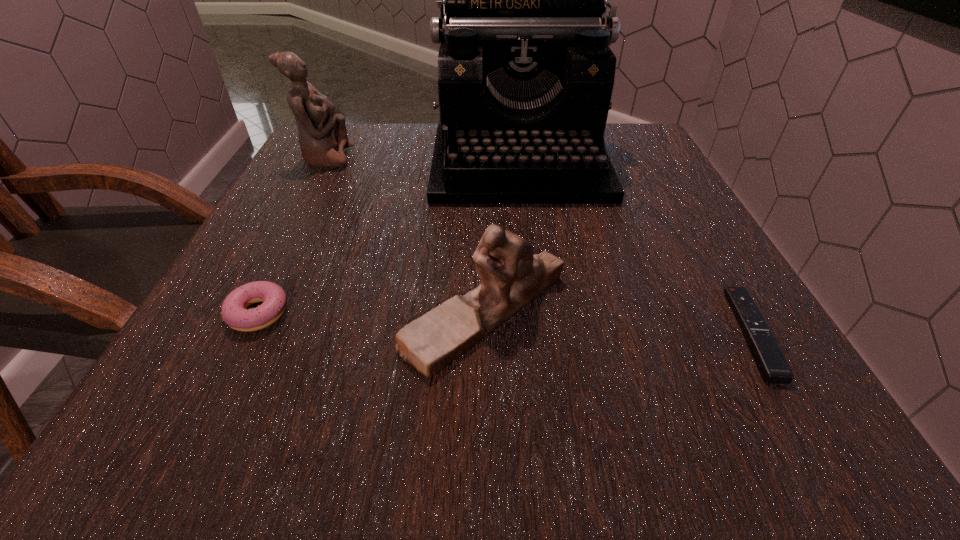
Identify the location of typewriter located at the right edge. This screenshot has height=540, width=960. (525, 74).

You are a GUI agent. You are given a task and a screenshot of the screen. Output one action in this format:
    pyautogui.click(x=<x>, y=<y>)
    Task: Click on the remote control positioned at the right edge
    The image size is (960, 540).
    Given the screenshot: What is the action you would take?
    tap(773, 367)

Locate an element on the screen. This screenshot has width=960, height=540. object that is positioned at the far left corner is located at coordinates (323, 137).

What are the coordinates of `object at the far right corner` in the screenshot? It's located at (525, 74).

You are a GUI agent. You are given a task and a screenshot of the screen. Output one action in this format:
    pyautogui.click(x=<x>, y=<y>)
    Task: Click on the object located at the near right corner
    Image resolution: width=960 pixels, height=540 pixels.
    Given the screenshot: What is the action you would take?
    pyautogui.click(x=773, y=367)

In the image, there is a desktop. What are the coordinates of `free space at the far edge` in the screenshot? It's located at (396, 122).

I want to click on free region at the near edge of the desktop, so click(x=630, y=445).

In the image, there is a desktop. Where is `vacant space at the left edge`? This screenshot has width=960, height=540. vacant space at the left edge is located at coordinates (340, 204).

Where is `vacant space at the right edge of the desktop`? Image resolution: width=960 pixels, height=540 pixels. vacant space at the right edge of the desktop is located at coordinates (642, 177).

In the image, there is a desktop. Find the location of `vacant space at the far right corner`. vacant space at the far right corner is located at coordinates (638, 152).